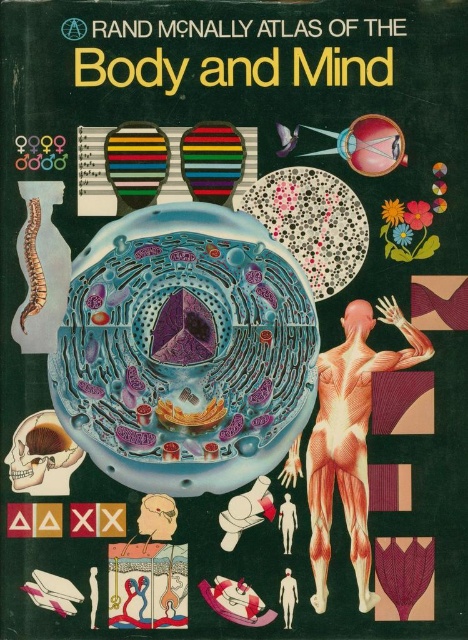
Is point (366, 557) closer to camera compared to point (297, 588)?

No, (366, 557) is further to viewer.

Is muscular flesh at center thinner than smooth human figure at center?

No.

This screenshot has width=468, height=640. What are the coordinates of `muscular flesh at center` in the screenshot? It's located at (350, 438).

Does smooth orange human figure at center have a greater width compared to smooth human figure at center?

Yes, smooth orange human figure at center is wider than smooth human figure at center.

Can you confirm if smooth orange human figure at center is positioned to the left of smooth human figure at center?

Indeed, smooth orange human figure at center is positioned on the left side of smooth human figure at center.

Who is more forward, (283, 550) or (284, 586)?

Positioned in front is point (284, 586).

The height and width of the screenshot is (640, 468). I want to click on smooth orange human figure at center, so click(x=286, y=522).

From the picture: Which is more to the left, muscular flesh at center or smooth orange human figure at center?

Positioned to the left is smooth orange human figure at center.

Which is behind, point (316, 499) or point (280, 524)?

The point (280, 524) is more distant.

Is point (385, 321) positioned in front of point (285, 547)?

No, it is not.

Find the location of a particular element. muscular flesh at center is located at coordinates (350, 438).